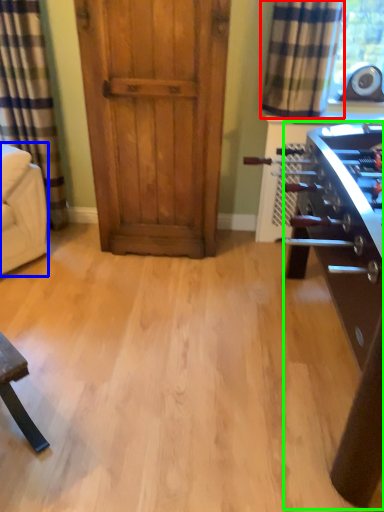
Question: Which is nearer to the curtain (highlighted by a red box)? armchair (highlighted by a blue box) or table (highlighted by a green box).

Choices:
 (A) armchair
 (B) table

Answer: (B)